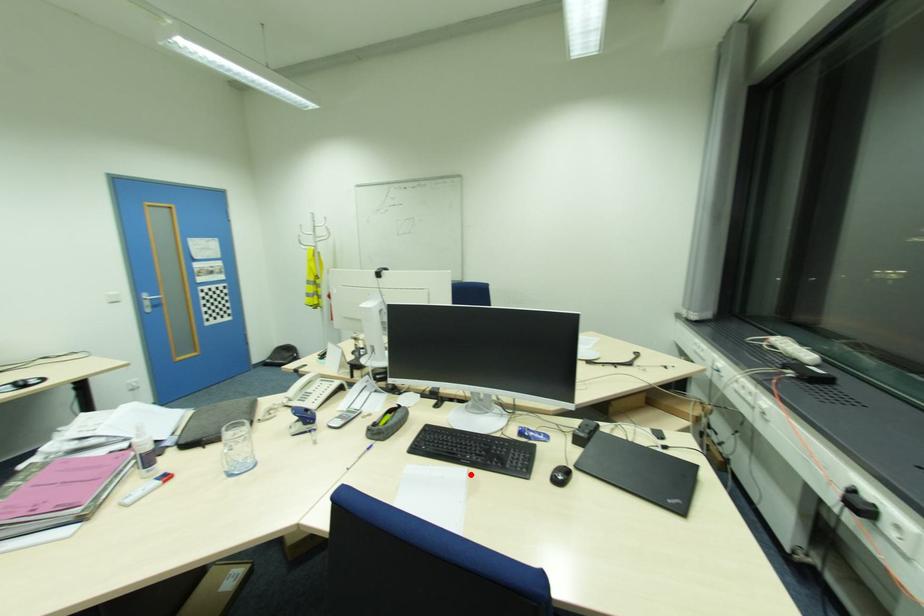
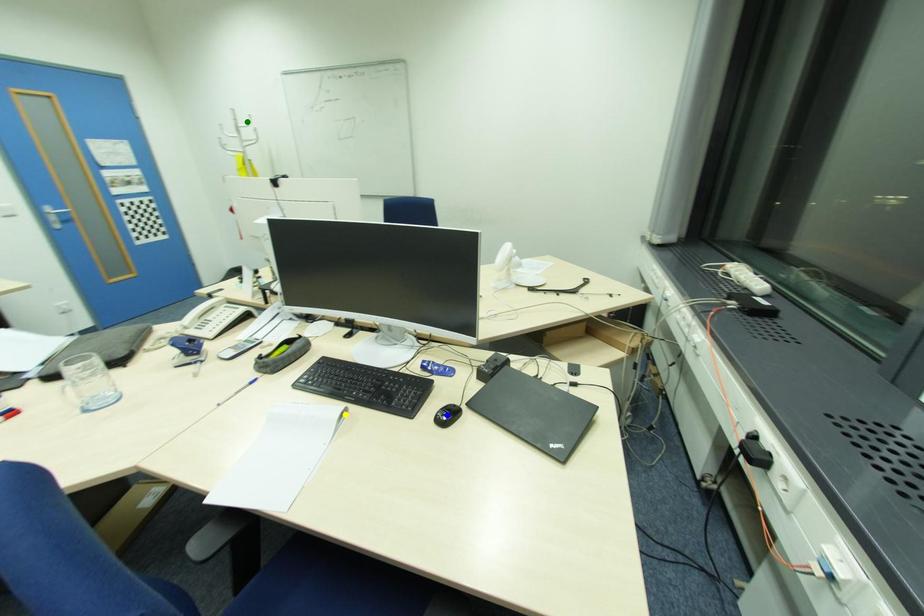
Question: I am providing you with two images of the same scene from different viewpoints. A red point is marked on the first image. You are given multiple points on the second image. Which spot in image 2 lines up with the point in image 1?

Choices:
 (A) yellow point
 (B) blue point
 (C) green point

Answer: (A)